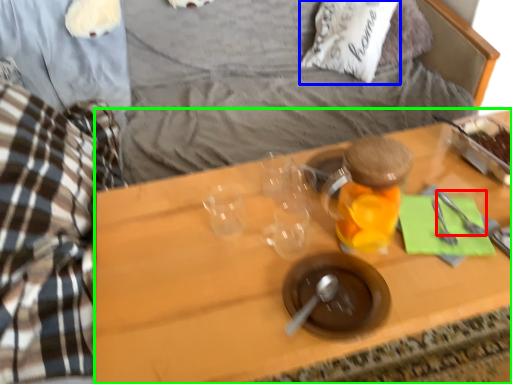
Question: Estimate the real-world distances between objects in this image. Which object is farther from silverware (highlighted by a red box), pillow (highlighted by a blue box) or desk (highlighted by a green box)?

Choices:
 (A) pillow
 (B) desk

Answer: (A)